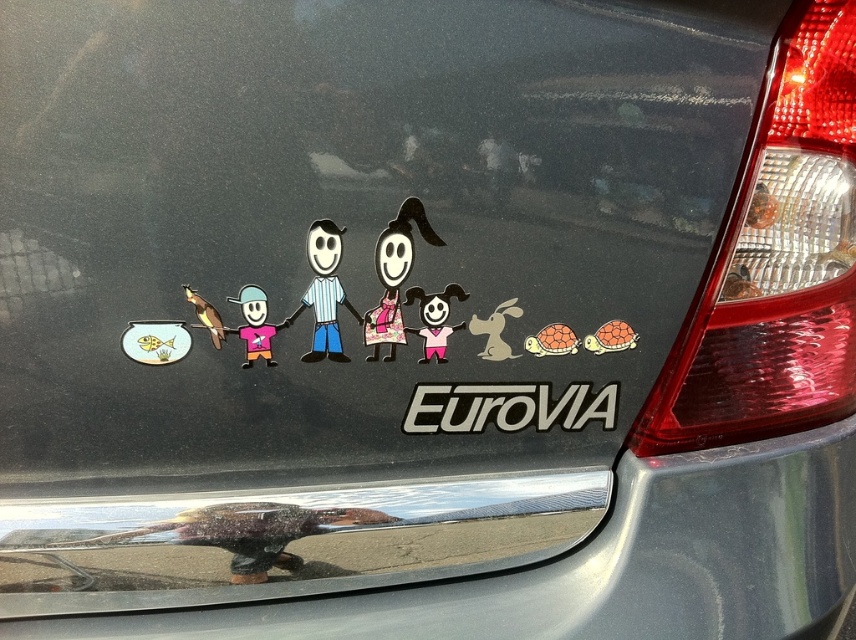
Question: Is matte plastic figure at center above matte pink shirt at center?

Choices:
 (A) yes
 (B) no

Answer: (A)

Question: Which of these objects is positioned closest to the gold metallic fish at left?

Choices:
 (A) matte pink shirt at center
 (B) matte black figure at center
 (C) matte plastic figure at center

Answer: (A)

Question: Considering the relative positions of matte plastic figure at center and matte pink shirt at center in the image provided, where is matte plastic figure at center located with respect to matte pink shirt at center?

Choices:
 (A) left
 (B) right

Answer: (B)

Question: Can you confirm if matte plastic figure at center is smaller than matte black figure at center?

Choices:
 (A) yes
 (B) no

Answer: (B)

Question: Which of these objects is positioned closest to the matte pink shirt at center?

Choices:
 (A) gold metallic fish at left
 (B) matte black figure at center

Answer: (A)

Question: Estimate the real-world distances between objects in this image. Which object is farther from the matte plastic figure at center?

Choices:
 (A) gold metallic fish at left
 (B) matte black figure at center
 (C) matte pink shirt at center

Answer: (A)